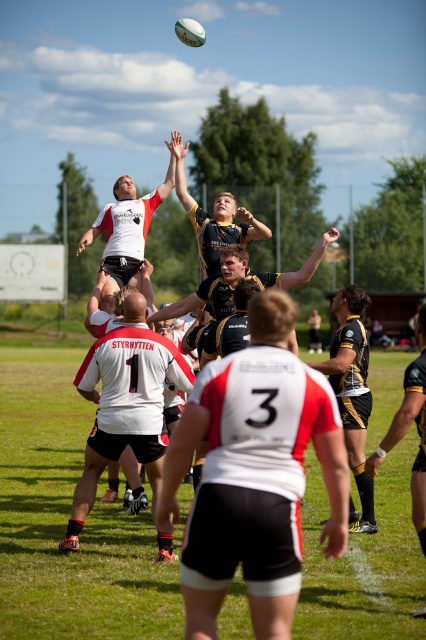
Question: Can you confirm if white matte jersey at center is smaller than gold textured jersey at center?

Choices:
 (A) yes
 (B) no

Answer: (B)

Question: Which object is the farthest from the white matte jersey at center?

Choices:
 (A) gold textured jersey at center
 (B) white matte rugby ball at upper center

Answer: (A)

Question: Can you confirm if gold textured jersey at center is smaller than white matte rugby ball at upper center?

Choices:
 (A) yes
 (B) no

Answer: (A)

Question: Does white matte jersey at center appear under gold textured jersey at center?

Choices:
 (A) yes
 (B) no

Answer: (A)

Question: Which point is closer to the camera?

Choices:
 (A) white matte jersey at center
 (B) white matte rugby ball at upper center

Answer: (A)

Question: Which point is closer to the camera?

Choices:
 (A) white matte jersey at center
 (B) gold textured jersey at center
 (C) white matte rugby ball at upper center

Answer: (A)